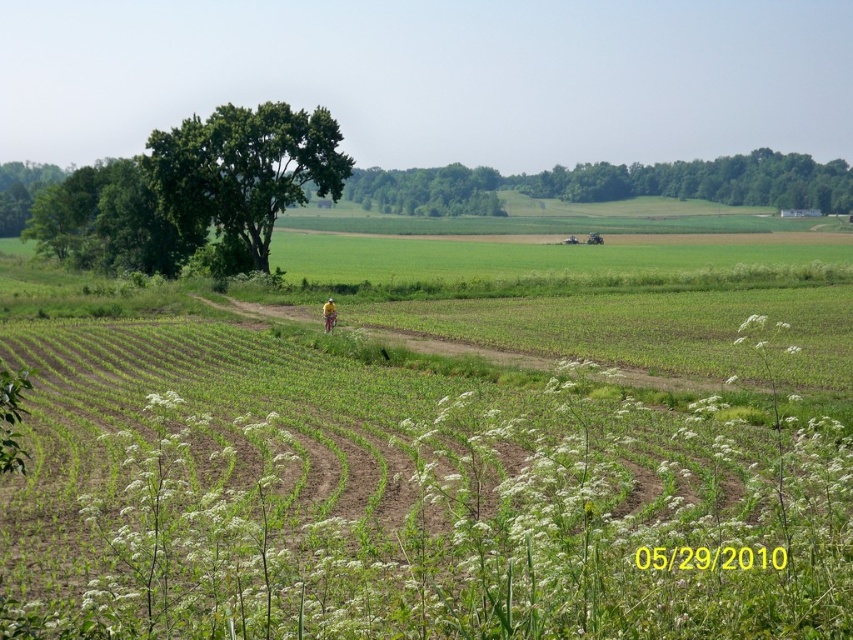
Between green leafy tree at upper left and green leafy tree at center, which one has less height?

green leafy tree at upper left is shorter.

Does green leafy tree at upper left come in front of green leafy tree at center?

Yes.

Describe the element at coordinates (244, 170) in the screenshot. Image resolution: width=853 pixels, height=640 pixels. I see `green leafy tree at upper left` at that location.

In order to click on green leafy tree at upper left in this screenshot , I will do `click(244, 170)`.

Between green leafy tree at upper left and green leafy tree at upper center, which one is positioned higher?

green leafy tree at upper center

Which is in front, point (210, 218) or point (445, 195)?

Point (210, 218) is in front.

The width and height of the screenshot is (853, 640). In order to click on green leafy tree at upper left in this screenshot , I will do `click(244, 170)`.

Measure the distance between point [256,205] and camera.

Point [256,205] and camera are 73.81 meters apart from each other.

The image size is (853, 640). Find the location of `green leafy tree at upper left`. green leafy tree at upper left is located at coordinates [244, 170].

Identify the location of green leafy tree at upper left. This screenshot has height=640, width=853. (244, 170).

Find the location of a particular element. green leafy tree at upper left is located at coordinates (244, 170).